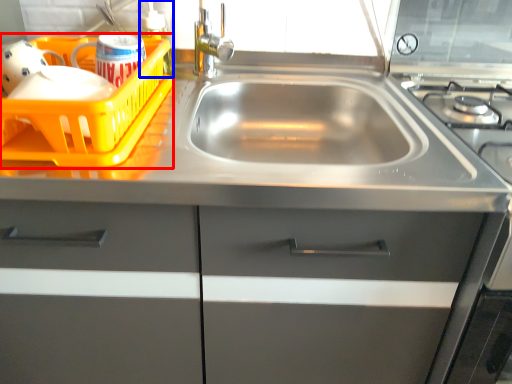
Question: Among these objects, which one is farthest to the camera, basket (highlighted by a red box) or bottle (highlighted by a blue box)?

Choices:
 (A) basket
 (B) bottle

Answer: (B)